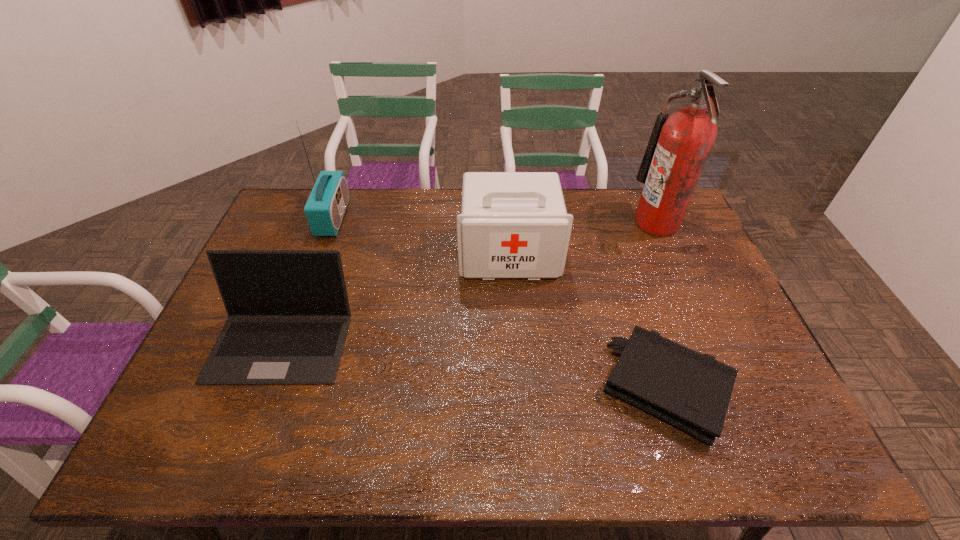
You are a GUI agent. You are given a task and a screenshot of the screen. Output one action in this format:
    pyautogui.click(x=<x>, y=<y>)
    Task: Click on the fire extinguisher
    
    Given the screenshot: What is the action you would take?
    pyautogui.click(x=678, y=148)

Identify the location of radio receiver. (325, 208).

Where is `the third shortest object`? the third shortest object is located at coordinates (512, 224).

At what (x,y) coordinates should I click in order to perform the action: click on the first-aid kit. Please return your answer as a coordinate pair (x, y). Image resolution: width=960 pixels, height=540 pixels. Looking at the image, I should click on (512, 224).

You are a GUI agent. You are given a task and a screenshot of the screen. Output one action in this format:
    pyautogui.click(x=<x>, y=<y>)
    Task: Click on the fourth tallest object
    The width and height of the screenshot is (960, 540).
    Given the screenshot: What is the action you would take?
    288,312

Find the location of a particular element. This screenshot has height=540, width=960. the shortest object is located at coordinates (691, 391).

Locate an element on the screen. The width and height of the screenshot is (960, 540). vacant space located on the front of the fire extinguisher near the operation label is located at coordinates (617, 223).

The height and width of the screenshot is (540, 960). I want to click on vacant point located 0.120m on the front of the fire extinguisher near the operation label, so click(600, 223).

Locate an element on the screen. free space located on the front of the fire extinguisher near the operation label is located at coordinates (577, 223).

Locate an element on the screen. free space located on the front panel of the radio receiver is located at coordinates [448, 218].